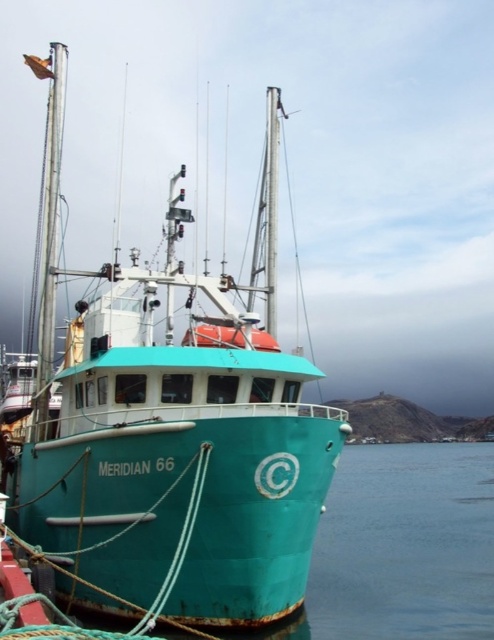
Question: Among these points, which one is nearest to the camera?

Choices:
 (A) (69, 525)
 (B) (335, 609)

Answer: (A)

Question: Which point is farther from the camera taking this photo?

Choices:
 (A) (219, 304)
 (B) (301, 611)

Answer: (A)

Question: Can you confirm if teal matte boat at center is bigger than teal rubber boat at center?

Choices:
 (A) yes
 (B) no

Answer: (B)

Question: Does teal matte boat at center appear on the right side of teal rubber boat at center?

Choices:
 (A) yes
 (B) no

Answer: (B)

Question: In this image, where is teal matte boat at center located relative to teal rubber boat at center?

Choices:
 (A) right
 (B) left

Answer: (B)